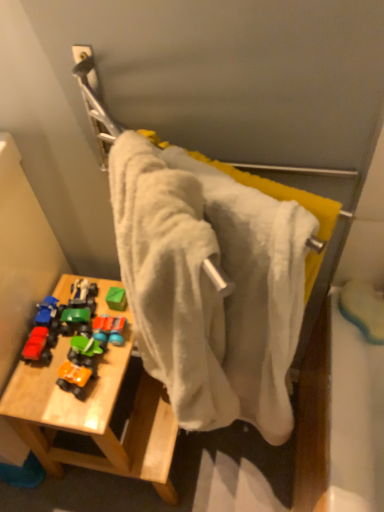
Identify the location of free space in front of rubberized plastic toy car at center, the 1th toy from the right. (95, 382).